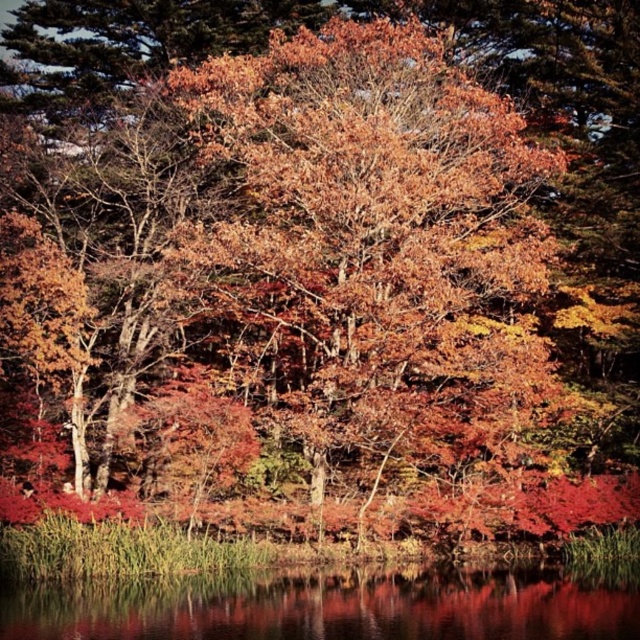
From the picture: You are standing in the autumnal landscape and want to pick up the autumn leaves at center and the transparent water at lower center. Which object is closer to you?

The autumn leaves at center is closer to you because it is further to the viewer than the transparent water at lower center.

You are standing on a path in the autumnal landscape and see the autumn leaves at center and the transparent water at lower center. Which object is located higher in the scene?

The autumn leaves at center are located above the transparent water at lower center, so they are higher in the scene.

You are standing at the viewpoint of the image and want to walk towards the two points labeled as point [429,272] and point [211,579]. Which point will you reach first?

You will reach point [429,272] first because it is closer to you than point [211,579].